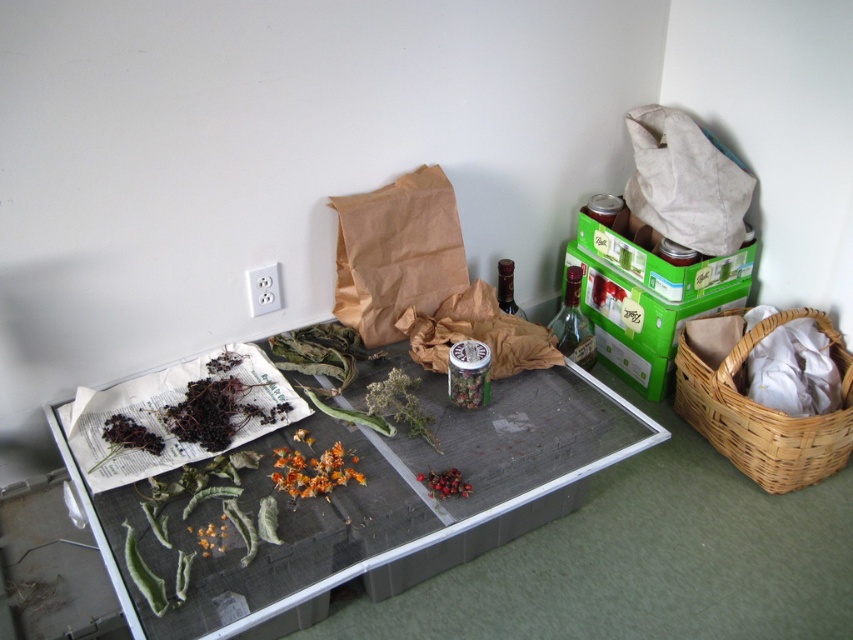
Question: From the image, what is the correct spatial relationship of woven brown basket at right in relation to orange matte flower at center?

Choices:
 (A) below
 (B) above

Answer: (B)

Question: Can you confirm if woven brown basket at right is positioned to the right of white fabric bag at upper right?

Choices:
 (A) yes
 (B) no

Answer: (A)

Question: Is green mesh tray at center further to camera compared to woven brown basket at right?

Choices:
 (A) yes
 (B) no

Answer: (B)

Question: Estimate the real-world distances between objects in this image. Which object is farther from the woven brown basket at right?

Choices:
 (A) white fabric bag at upper right
 (B) bright red berries at center
 (C) orange matte flower at center
 (D) brown paper bag at center

Answer: (C)

Question: Among these objects, which one is farthest from the camera?

Choices:
 (A) white fabric bag at upper right
 (B) green mesh tray at center
 (C) woven brown basket at right

Answer: (A)

Question: Estimate the real-world distances between objects in this image. Which object is closer to the green mesh tray at center?

Choices:
 (A) bright red berries at center
 (B) brown paper bag at center
 (C) woven brown basket at right
 (D) orange matte flower at center

Answer: (D)